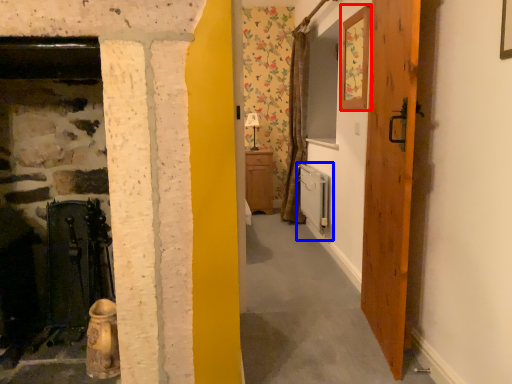
Question: Which object is closer to the camera taking this photo, picture frame (highlighted by a red box) or appliance (highlighted by a blue box)?

Choices:
 (A) picture frame
 (B) appliance

Answer: (A)